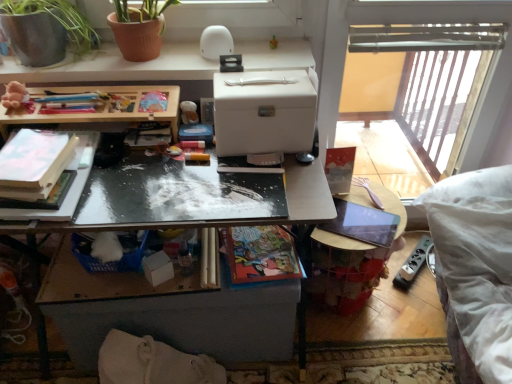
The height and width of the screenshot is (384, 512). Find the location of `vacant point above wooden at upper left, marked as the second table in a bottom-to-top arrangement (from a real-world perspective)`. vacant point above wooden at upper left, marked as the second table in a bottom-to-top arrangement (from a real-world perspective) is located at coordinates (94, 97).